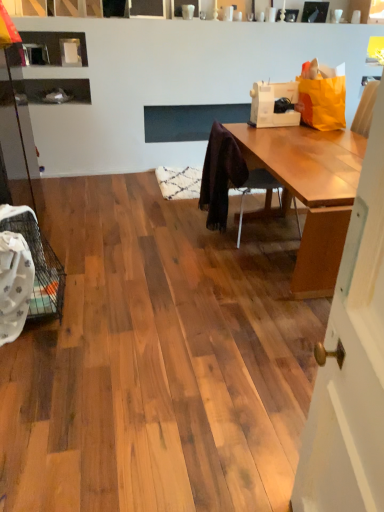
Question: Is wooden chair at center to the left of white plastic sewing machine at upper right from the viewer's perspective?

Choices:
 (A) yes
 (B) no

Answer: (A)

Question: From the image's perspective, would you say wooden chair at center is positioned over white plastic sewing machine at upper right?

Choices:
 (A) yes
 (B) no

Answer: (B)

Question: Is wooden chair at center far from white plastic sewing machine at upper right?

Choices:
 (A) no
 (B) yes

Answer: (A)

Question: From the image's perspective, is wooden chair at center beneath white plastic sewing machine at upper right?

Choices:
 (A) yes
 (B) no

Answer: (A)

Question: Is white plastic sewing machine at upper right located within wooden chair at center?

Choices:
 (A) no
 (B) yes

Answer: (A)

Question: Is the depth of wooden chair at center less than that of white plastic sewing machine at upper right?

Choices:
 (A) yes
 (B) no

Answer: (A)

Question: Does white plastic sewing machine at upper right have a smaller size compared to wooden chair at center?

Choices:
 (A) yes
 (B) no

Answer: (A)

Question: From the image's perspective, is white plastic sewing machine at upper right above wooden chair at center?

Choices:
 (A) yes
 (B) no

Answer: (A)

Question: Does white plastic sewing machine at upper right lie in front of wooden chair at center?

Choices:
 (A) no
 (B) yes

Answer: (A)

Question: Is white plastic sewing machine at upper right not inside wooden chair at center?

Choices:
 (A) yes
 (B) no

Answer: (A)

Question: Is wooden chair at center a part of white plastic sewing machine at upper right?

Choices:
 (A) no
 (B) yes

Answer: (A)

Question: From a real-world perspective, is white plastic sewing machine at upper right below wooden chair at center?

Choices:
 (A) yes
 (B) no

Answer: (B)

Question: From a real-world perspective, relative to wooden chair at center, is white plastic sewing machine at upper right vertically above or below?

Choices:
 (A) above
 (B) below

Answer: (A)